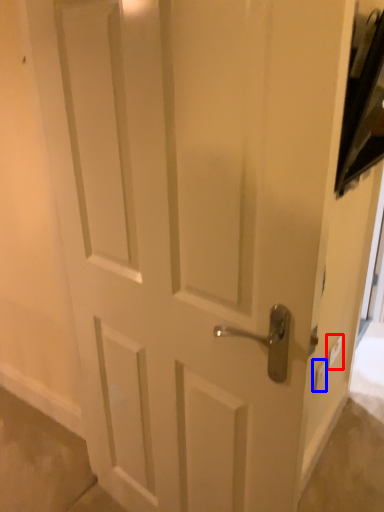
Question: Which object appears closest to the camera in this image, light switch (highlighted by a red box) or light switch (highlighted by a blue box)?

Choices:
 (A) light switch
 (B) light switch

Answer: (B)